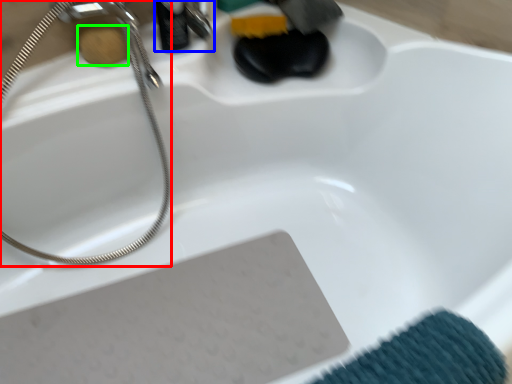
Question: Estimate the real-world distances between objects in this image. Which object is closer to shower (highlighted by a red box), faucet (highlighted by a blue box) or soap (highlighted by a green box)?

Choices:
 (A) faucet
 (B) soap

Answer: (B)